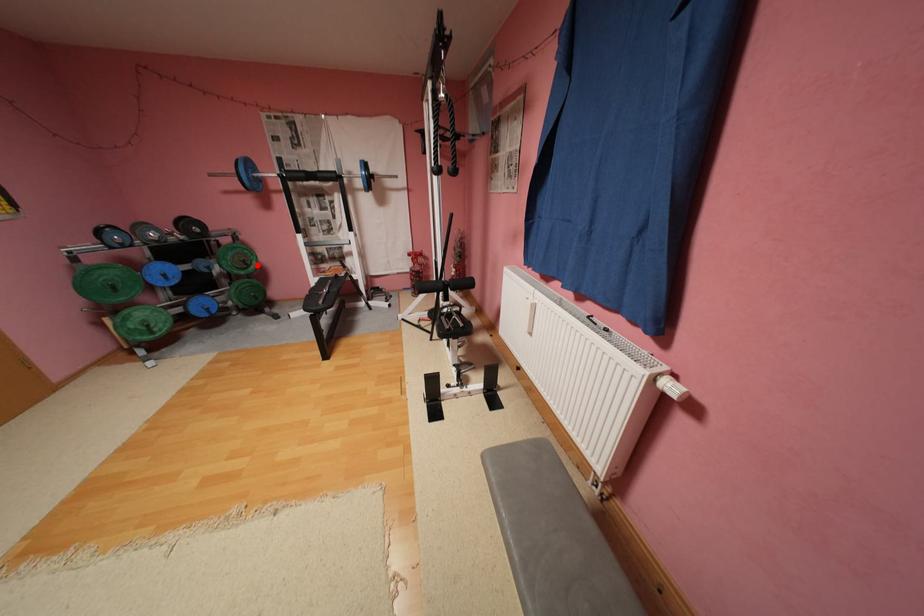
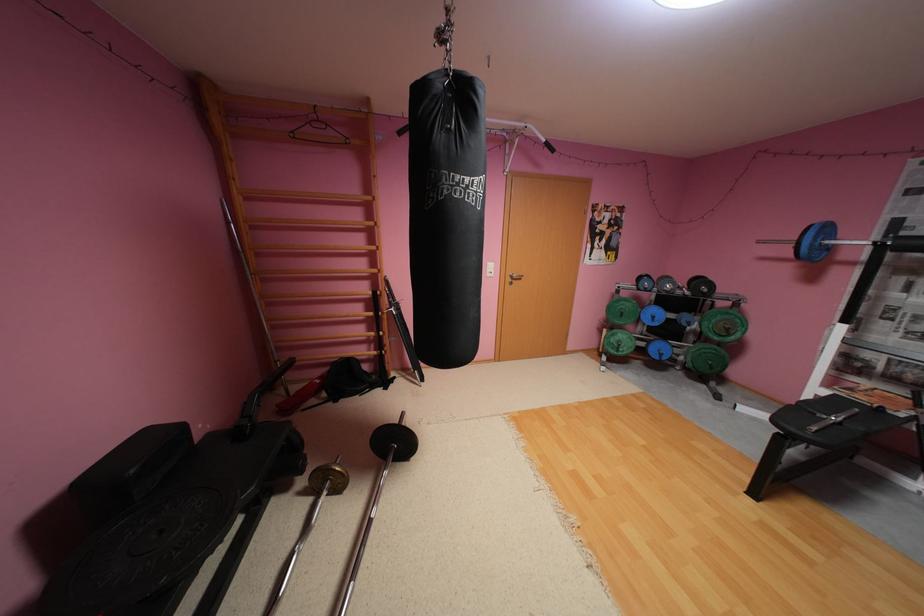
Where in the second image is the point corresponding to the highlighted location from the first image?

(737, 334)